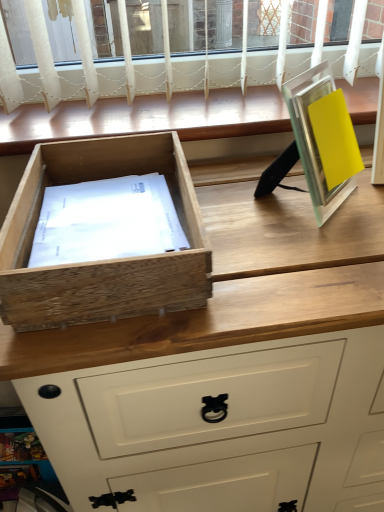
This screenshot has width=384, height=512. What are the coordinates of `natural wood chest of drawers at center` in the screenshot? It's located at [217, 395].

What is the approximate width of wooden window sill at upper center?

wooden window sill at upper center is 10.83 inches wide.

Locate an element on the screen. natural wood drawer at left is located at coordinates (102, 261).

Is natural wood drawer at left looking in the opposite direction of wooden window sill at upper center?

That's right, natural wood drawer at left is facing away from wooden window sill at upper center.

Based on the photo, what's the angular difference between natural wood drawer at left and wooden window sill at upper center's facing directions?

0.342 degrees separate the facing orientations of natural wood drawer at left and wooden window sill at upper center.

Does natural wood drawer at left appear on the right side of wooden window sill at upper center?

No, natural wood drawer at left is not to the right of wooden window sill at upper center.

You are a GUI agent. You are given a task and a screenshot of the screen. Output one action in this format:
    pyautogui.click(x=<x>, y=<y>)
    Task: Click on the drawer that appears below the wooden window sill at upper center (from the image's perspective)
    The height and width of the screenshot is (512, 384).
    Given the screenshot: What is the action you would take?
    pyautogui.click(x=102, y=261)

From a real-world perspective, is wooden window sill at upper center positioned under natural wood drawer at left based on gravity?

→ No, from a real-world perspective, wooden window sill at upper center is not below natural wood drawer at left.

Can you confirm if wooden window sill at upper center is taller than natural wood drawer at left?

Incorrect, the height of wooden window sill at upper center is not larger of that of natural wood drawer at left.

In the scene shown: From the image's perspective, relative to natural wood drawer at left, is wooden window sill at upper center above or below?

Based on their image positions, wooden window sill at upper center is located above natural wood drawer at left.

Image resolution: width=384 pixels, height=512 pixels. I want to click on drawer that appears above the natural wood chest of drawers at center (from a real-world perspective), so click(102, 261).

Between point (119, 286) and point (75, 154), which one is positioned behind?

The point (75, 154) is farther from the camera.

From a real-world perspective, does natural wood drawer at left sit lower than natural wood chest of drawers at center?

Actually, natural wood drawer at left is physically above natural wood chest of drawers at center in the real world.

Considering the sizes of objects natural wood drawer at left and natural wood chest of drawers at center in the image provided, who is shorter, natural wood drawer at left or natural wood chest of drawers at center?

natural wood drawer at left.

Is natural wood chest of drawers at center turned away from metallic silver picture frame at right?

natural wood chest of drawers at center does not have its back to metallic silver picture frame at right.

Is natural wood chest of drawers at center in front of or behind metallic silver picture frame at right in the image?

Clearly, natural wood chest of drawers at center is in front of metallic silver picture frame at right.

From the image's perspective, which is above, natural wood chest of drawers at center or metallic silver picture frame at right?

metallic silver picture frame at right.

Looking at this image, from the image's perspective, is natural wood chest of drawers at center located beneath natural wood drawer at left?

Yes.

Does point (201, 339) appear closer or farther from the camera than point (80, 265)?

Point (201, 339) is farther from the camera than point (80, 265).

Between natural wood chest of drawers at center and natural wood drawer at left, which one has smaller size?

With smaller size is natural wood drawer at left.

What are the coordinates of `drawer above the natural wood chest of drawers at center (from a real-world perspective)` in the screenshot? It's located at (102, 261).

Is wooden window sill at upper center next to metallic silver picture frame at right and touching it?

No, wooden window sill at upper center is not touching metallic silver picture frame at right.

Which object is wider, wooden window sill at upper center or metallic silver picture frame at right?

wooden window sill at upper center is wider.

Who is bigger, wooden window sill at upper center or metallic silver picture frame at right?

With larger size is wooden window sill at upper center.

From the image's perspective, is wooden window sill at upper center on top of metallic silver picture frame at right?

Indeed, from the image's perspective, wooden window sill at upper center is shown above metallic silver picture frame at right.

From a real-world perspective, which is physically below, natural wood chest of drawers at center or wooden window sill at upper center?

From a 3D spatial view, natural wood chest of drawers at center is below.

Is natural wood chest of drawers at center directly adjacent to wooden window sill at upper center?

No, natural wood chest of drawers at center is not making contact with wooden window sill at upper center.

Which of these two, natural wood chest of drawers at center or wooden window sill at upper center, is thinner?

wooden window sill at upper center.

Is natural wood chest of drawers at center taller than wooden window sill at upper center?

Yes, natural wood chest of drawers at center is taller than wooden window sill at upper center.

Locate an element on the screen. The width and height of the screenshot is (384, 512). drawer lying on the left of wooden window sill at upper center is located at coordinates (102, 261).

Identify the location of drawer beneath the wooden window sill at upper center (from a real-world perspective). (102, 261).

Based on their spatial positions, is natural wood drawer at left or wooden window sill at upper center further from natural wood chest of drawers at center?

wooden window sill at upper center is further to natural wood chest of drawers at center.

In the scene shown: Considering their positions, is natural wood drawer at left positioned closer to wooden window sill at upper center than natural wood chest of drawers at center?

natural wood drawer at left is closer to wooden window sill at upper center.

Looking at the image, which one is located closer to metallic silver picture frame at right, natural wood drawer at left or natural wood chest of drawers at center?

natural wood drawer at left.

From the picture: When comparing their distances from natural wood chest of drawers at center, does wooden window sill at upper center or natural wood drawer at left seem closer?

Among the two, natural wood drawer at left is located nearer to natural wood chest of drawers at center.

Considering their positions, is natural wood chest of drawers at center positioned further to metallic silver picture frame at right than natural wood drawer at left?

Among the two, natural wood chest of drawers at center is located further to metallic silver picture frame at right.

Estimate the real-world distances between objects in this image. Which object is closer to natural wood drawer at left, natural wood chest of drawers at center or wooden window sill at upper center?

natural wood chest of drawers at center is closer to natural wood drawer at left.

From the picture: Looking at the image, which one is located further to wooden window sill at upper center, metallic silver picture frame at right or natural wood chest of drawers at center?

Among the two, natural wood chest of drawers at center is located further to wooden window sill at upper center.

In the scene shown: Which object lies further to the anchor point metallic silver picture frame at right, wooden window sill at upper center or natural wood drawer at left?

wooden window sill at upper center is further to metallic silver picture frame at right.

Where is `drawer between metallic silver picture frame at right and natural wood chest of drawers at center in the vertical direction`? drawer between metallic silver picture frame at right and natural wood chest of drawers at center in the vertical direction is located at coordinates (102, 261).

Locate an element on the screen. The width and height of the screenshot is (384, 512). picture frame between natural wood drawer at left and wooden window sill at upper center along the z-axis is located at coordinates (314, 138).

Find the location of a particular element. The width and height of the screenshot is (384, 512). picture frame between wooden window sill at upper center and natural wood chest of drawers at center vertically is located at coordinates (314, 138).

The width and height of the screenshot is (384, 512). In order to click on drawer between wooden window sill at upper center and natural wood chest of drawers at center in the up-down direction in this screenshot , I will do `click(102, 261)`.